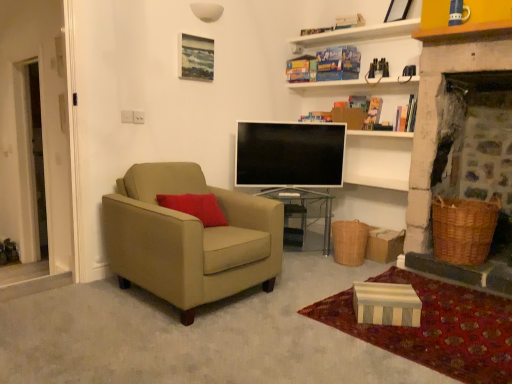
Describe the element at coordinates (464, 229) in the screenshot. I see `woven brown picnic basket at lower right, which is counted as the 1th picnic basket, starting from the right` at that location.

Where is `woven brown picnic basket at lower right, acting as the 2th picnic basket starting from the left`? The image size is (512, 384). woven brown picnic basket at lower right, acting as the 2th picnic basket starting from the left is located at coordinates (464, 229).

The width and height of the screenshot is (512, 384). What are the coordinates of `striped cardboard box at lower right` in the screenshot? It's located at (386, 304).

What do you see at coordinates (189, 238) in the screenshot? The width and height of the screenshot is (512, 384). I see `suede beige armchair at left` at bounding box center [189, 238].

Identify the location of matte wooden picture frame at upper center. The height and width of the screenshot is (384, 512). (196, 58).

What is the approximate height of transparent glass table at center?

It is 19.84 inches.

Identify the location of striped cardboard box at lower right. (436, 328).

Is transparent glass table at center inside or outside of suede beige armchair at left?

transparent glass table at center is located beyond the bounds of suede beige armchair at left.

Which is in front, point (329, 244) or point (165, 253)?

Positioned in front is point (165, 253).

The image size is (512, 384). I want to click on chair above the transparent glass table at center (from the image's perspective), so click(189, 238).

In the scene shown: Which of these two, suede beige armchair at left or woven brown picnic basket at lower center, the first picnic basket positioned from the left, is bigger?

suede beige armchair at left is bigger.

From a real-world perspective, is suede beige armchair at left on top of woven brown picnic basket at lower center, which is the 2th picnic basket in right-to-left order?

Yes.

Does suede beige armchair at left appear on the left side of woven brown picnic basket at lower center, the first picnic basket positioned from the left?

Yes.

Between point (111, 227) and point (355, 248), which one is positioned behind?

The point (355, 248) is more distant.

Measure the distance from striped cardboard box at lower right to transparent glass table at center.

striped cardboard box at lower right is 1.24 meters away from transparent glass table at center.

From the picture: From a real-world perspective, which is physically above, striped cardboard box at lower right or transparent glass table at center?

From a 3D spatial view, transparent glass table at center is above.

From the image's perspective, does striped cardboard box at lower right appear lower than transparent glass table at center?

Indeed, from the image's perspective, striped cardboard box at lower right is shown beneath transparent glass table at center.

Identify the location of table lying above the striped cardboard box at lower right (from the image's perspective). (303, 205).

Does point (278, 186) lie in front of point (153, 248)?

No, (278, 186) is behind (153, 248).

Between flat screen tv at center and suede beige armchair at left, which one is positioned behind?

flat screen tv at center is further from the camera.

From the picture: Does flat screen tv at center appear on the left side of suede beige armchair at left?

No.

Could you tell me if flat screen tv at center is turned towards suede beige armchair at left?

No, flat screen tv at center is not facing towards suede beige armchair at left.

What are the coordinates of `table that is above the striped cardboard box at lower right (from the image's perspective)` in the screenshot? It's located at (303, 205).

Based on their positions, is transparent glass table at center located to the left or right of striped cardboard box at lower right?

Based on their positions, transparent glass table at center is located to the left of striped cardboard box at lower right.

Considering the relative sizes of transparent glass table at center and striped cardboard box at lower right in the image provided, is transparent glass table at center wider than striped cardboard box at lower right?

Yes, transparent glass table at center is wider than striped cardboard box at lower right.

Would you say striped cardboard box at lower right is part of transparent glass table at center's contents?

No, striped cardboard box at lower right is not a part of transparent glass table at center.

Would you say woven brown picnic basket at lower right, which is counted as the 1th picnic basket, starting from the right, is outside matte wooden picture frame at upper center?

That's correct, woven brown picnic basket at lower right, which is counted as the 1th picnic basket, starting from the right, is outside of matte wooden picture frame at upper center.

Who is shorter, woven brown picnic basket at lower right, acting as the 2th picnic basket starting from the left, or matte wooden picture frame at upper center?

matte wooden picture frame at upper center is shorter.

Can you confirm if woven brown picnic basket at lower right, acting as the 2th picnic basket starting from the left, is positioned to the left of matte wooden picture frame at upper center?

Incorrect, woven brown picnic basket at lower right, acting as the 2th picnic basket starting from the left, is not on the left side of matte wooden picture frame at upper center.

How many degrees apart are the facing directions of woven brown picnic basket at lower right, acting as the 2th picnic basket starting from the left, and matte wooden picture frame at upper center?

The angle between the facing direction of woven brown picnic basket at lower right, acting as the 2th picnic basket starting from the left, and the facing direction of matte wooden picture frame at upper center is 95.2 degrees.

In terms of height, does flat screen tv at center look taller or shorter compared to striped cardboard box at lower right?

Considering their sizes, flat screen tv at center has more height than striped cardboard box at lower right.

Is flat screen tv at center positioned beyond the bounds of striped cardboard box at lower right?

flat screen tv at center is positioned outside striped cardboard box at lower right.

Based on the photo, is flat screen tv at center directly adjacent to striped cardboard box at lower right?

No, flat screen tv at center is not beside striped cardboard box at lower right.

I want to click on table below the suede beige armchair at left (from the image's perspective), so click(x=303, y=205).

The image size is (512, 384). In the image, there is a woven brown picnic basket at lower center, which is the 2th picnic basket in right-to-left order. In order to click on chair above it (from the image's perspective) in this screenshot , I will do `click(189, 238)`.

Estimate the real-world distances between objects in this image. Which object is closer to woven brown picnic basket at lower center, the first picnic basket positioned from the left, suede beige armchair at left or matte wooden picture frame at upper center?

Among the two, suede beige armchair at left is located nearer to woven brown picnic basket at lower center, the first picnic basket positioned from the left.

From the image, which object appears to be farther from matte wooden picture frame at upper center, transparent glass table at center or woven brown picnic basket at lower right, acting as the 2th picnic basket starting from the left?

woven brown picnic basket at lower right, acting as the 2th picnic basket starting from the left, lies further to matte wooden picture frame at upper center than the other object.

Looking at the image, which one is located further to transparent glass table at center, matte wooden picture frame at upper center or striped cardboard box at lower right?

Based on the image, matte wooden picture frame at upper center appears to be further to transparent glass table at center.

Looking at the image, which one is located further to flat screen tv at center, striped cardboard box at lower right or woven brown picnic basket at lower right, which is counted as the 1th picnic basket, starting from the right?

striped cardboard box at lower right lies further to flat screen tv at center than the other object.

Based on their spatial positions, is flat screen tv at center or striped cardboard box at lower right further from woven brown picnic basket at lower right, acting as the 2th picnic basket starting from the left?

Among the two, flat screen tv at center is located further to woven brown picnic basket at lower right, acting as the 2th picnic basket starting from the left.

Which object lies nearer to the anchor point striped cardboard box at lower right, striped cardboard box at lower right or suede beige armchair at left?

striped cardboard box at lower right lies closer to striped cardboard box at lower right than the other object.

From the image, which object appears to be nearer to suede beige armchair at left, flat screen tv at center or matte wooden picture frame at upper center?

flat screen tv at center is closer to suede beige armchair at left.

Based on their spatial positions, is striped cardboard box at lower right or flat screen tv at center closer to woven brown picnic basket at lower right, acting as the 2th picnic basket starting from the left?

Based on the image, striped cardboard box at lower right appears to be nearer to woven brown picnic basket at lower right, acting as the 2th picnic basket starting from the left.

Find the location of a particular element. This screenshot has height=384, width=512. table between matte wooden picture frame at upper center and striped cardboard box at lower right in the up-down direction is located at coordinates (303, 205).

Locate an element on the screen. This screenshot has width=512, height=384. television located between suede beige armchair at left and woven brown picnic basket at lower right, acting as the 2th picnic basket starting from the left, in the left-right direction is located at coordinates (290, 154).

At what (x,y) coordinates should I click in order to perform the action: click on table between suede beige armchair at left and woven brown picnic basket at lower right, acting as the 2th picnic basket starting from the left, in the horizontal direction. Please return your answer as a coordinate pair (x, y). This screenshot has height=384, width=512. Looking at the image, I should click on (303, 205).

Locate an element on the screen. This screenshot has width=512, height=384. box between suede beige armchair at left and flat screen tv at center in the front-back direction is located at coordinates (386, 304).